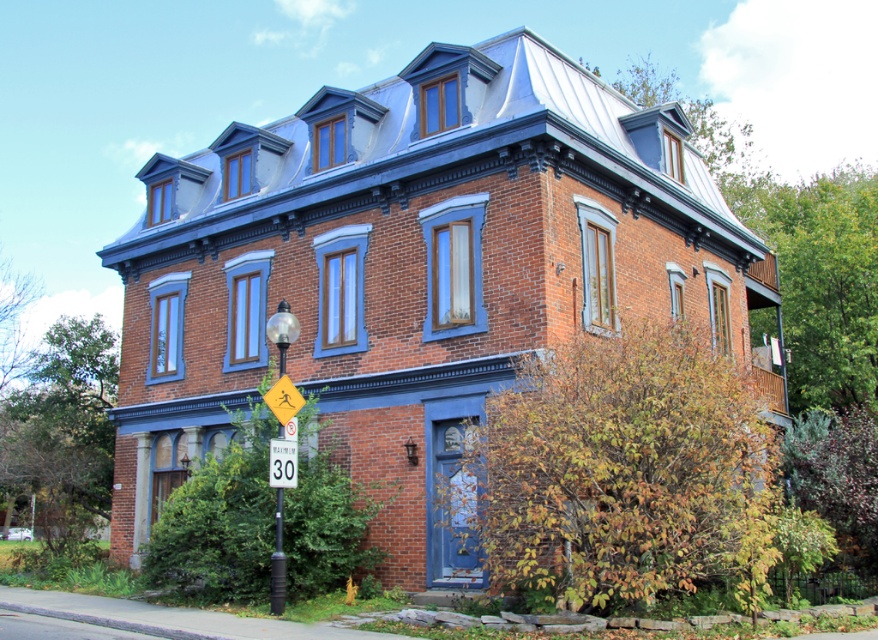
Measure the distance between yellow plastic sign at lower center and camera.

The distance of yellow plastic sign at lower center from camera is 64.73 feet.

Between yellow plastic sign at lower center and white plastic speed limit sign at center, which one is positioned lower?

yellow plastic sign at lower center

What are the coordinates of `yellow plastic sign at lower center` in the screenshot? It's located at (277, 563).

In order to click on yellow plastic sign at lower center in this screenshot , I will do `click(277, 563)`.